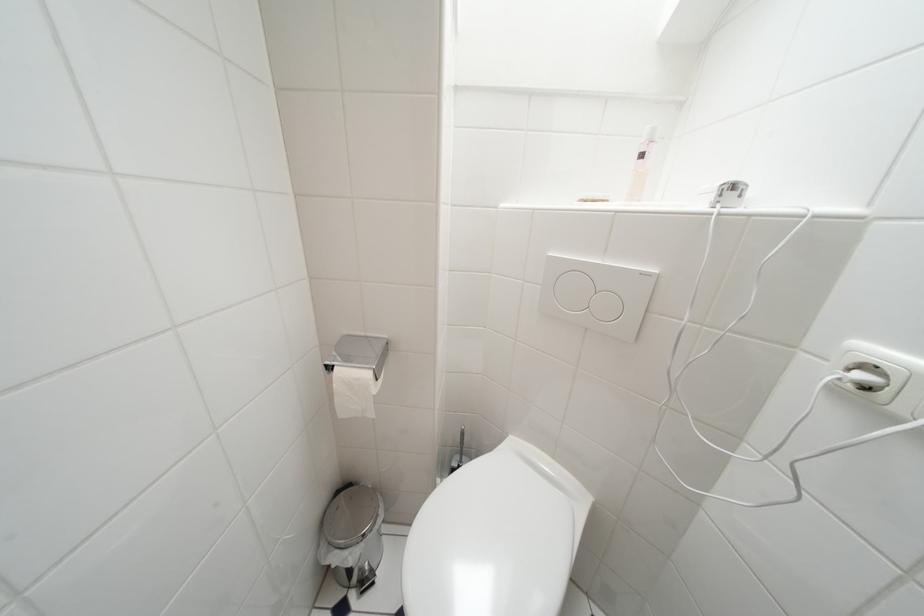
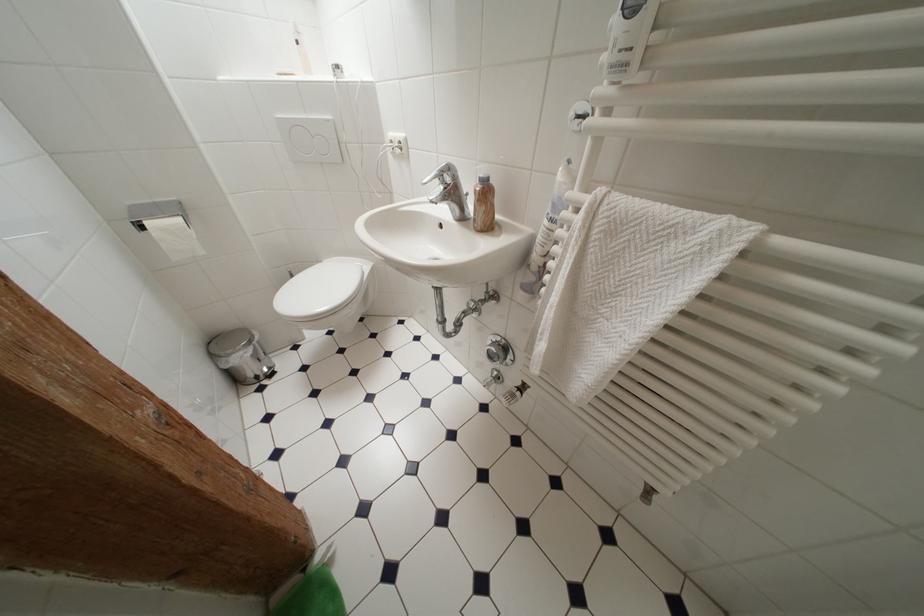
Find the pixel in the second image that matches [353,554] in the first image.

(249, 355)